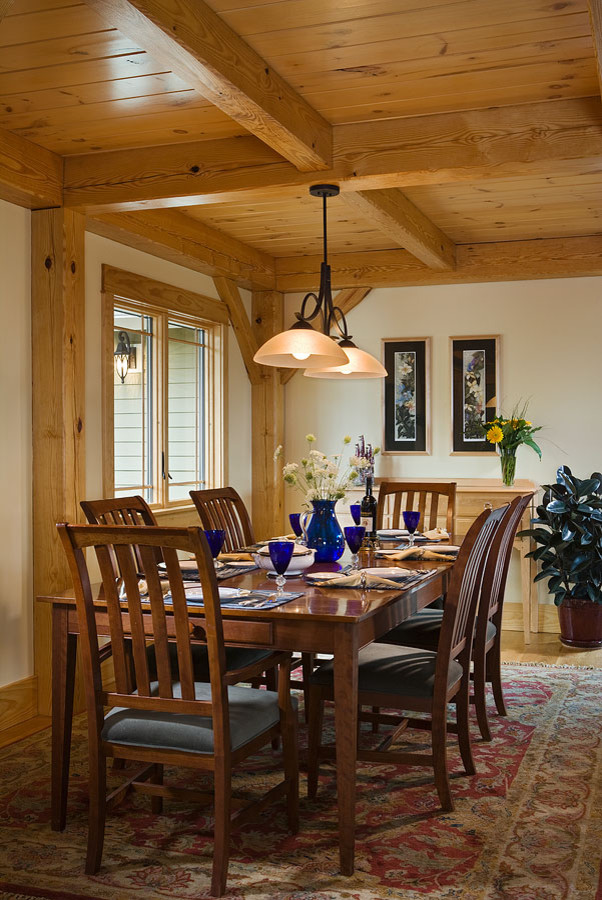
This screenshot has height=900, width=602. I want to click on dining table, so click(x=333, y=604).